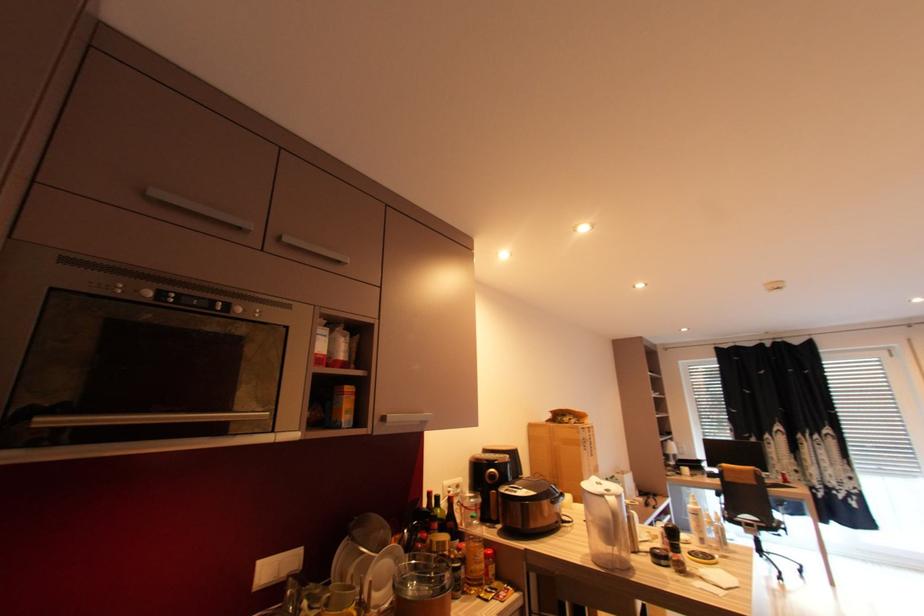
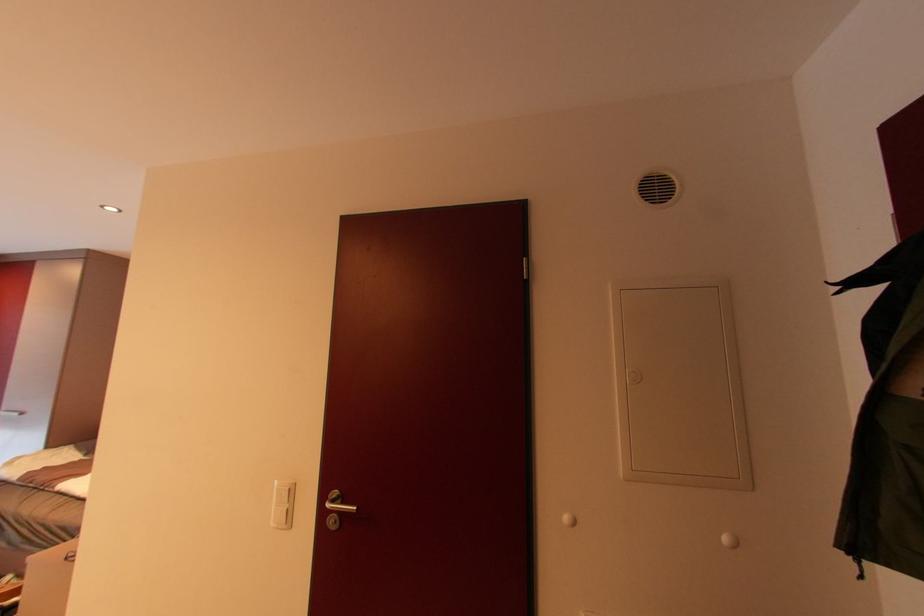
First-person continuous shooting, in which direction is the camera rotating?

The camera rotated toward right-up.